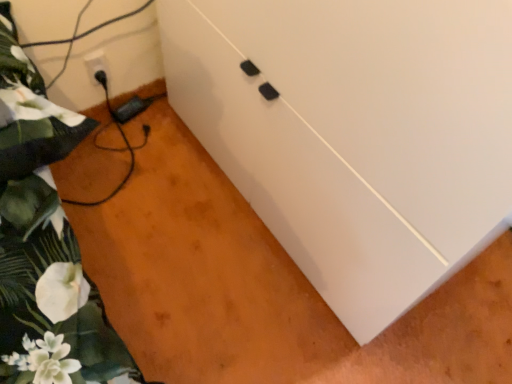
Question: From the image's perspective, would you say green floral fabric at left is positioned over white matte cabinet at center?

Choices:
 (A) no
 (B) yes

Answer: (A)

Question: Can you confirm if green floral fabric at left is bigger than white matte cabinet at center?

Choices:
 (A) no
 (B) yes

Answer: (A)

Question: Is green floral fabric at left smaller than white matte cabinet at center?

Choices:
 (A) no
 (B) yes

Answer: (B)

Question: Is green floral fabric at left looking in the opposite direction of white matte cabinet at center?

Choices:
 (A) yes
 (B) no

Answer: (B)

Question: Could you tell me if green floral fabric at left is turned towards white matte cabinet at center?

Choices:
 (A) no
 (B) yes

Answer: (A)

Question: Is green floral fabric at left positioned in front of white matte cabinet at center?

Choices:
 (A) no
 (B) yes

Answer: (A)

Question: From a real-world perspective, is white matte cabinet at center on top of white plastic electric outlet at lower left?

Choices:
 (A) no
 (B) yes

Answer: (B)

Question: Does white matte cabinet at center touch white plastic electric outlet at lower left?

Choices:
 (A) yes
 (B) no

Answer: (B)

Question: Is white matte cabinet at center taller than white plastic electric outlet at lower left?

Choices:
 (A) no
 (B) yes

Answer: (B)

Question: Could you tell me if white matte cabinet at center is turned towards white plastic electric outlet at lower left?

Choices:
 (A) yes
 (B) no

Answer: (A)

Question: Is there a large distance between white matte cabinet at center and white plastic electric outlet at lower left?

Choices:
 (A) no
 (B) yes

Answer: (A)

Question: Is white matte cabinet at center at the left side of white plastic electric outlet at lower left?

Choices:
 (A) yes
 (B) no

Answer: (B)

Question: Would you consider white matte cabinet at center to be distant from green floral fabric at left?

Choices:
 (A) no
 (B) yes

Answer: (A)